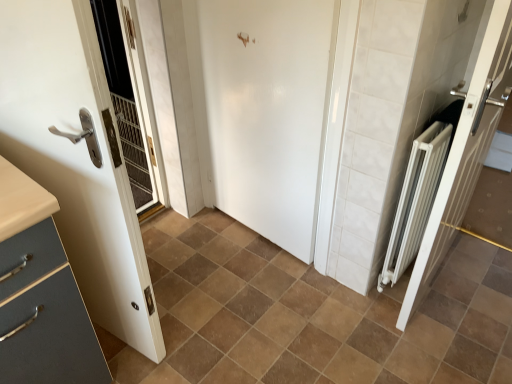
Question: Considering the positions of point (68, 203) and point (252, 31), is point (68, 203) closer or farther from the camera than point (252, 31)?

Choices:
 (A) farther
 (B) closer

Answer: (B)

Question: Considering the positions of white glossy door at left, the 3th door in the right-to-left sequence, and white glossy door at center, which is the second door from right to left, in the image, is white glossy door at left, the 3th door in the right-to-left sequence, taller or shorter than white glossy door at center, which is the second door from right to left,?

Choices:
 (A) short
 (B) tall

Answer: (B)

Question: Which object is positioned farthest from the white metallic radiator at right, placed as the third door when sorted from left to right?

Choices:
 (A) white glossy door at center, which is the second door from right to left
 (B) brown matte tile at center
 (C) white glossy door at left, the 3th door in the right-to-left sequence

Answer: (C)

Question: Which is farther from the white glossy door at left, the first door from the left?

Choices:
 (A) white glossy door at center, the 2th door in the left-to-right sequence
 (B) white metallic radiator at right, placed as the third door when sorted from left to right
 (C) brown matte tile at center

Answer: (B)